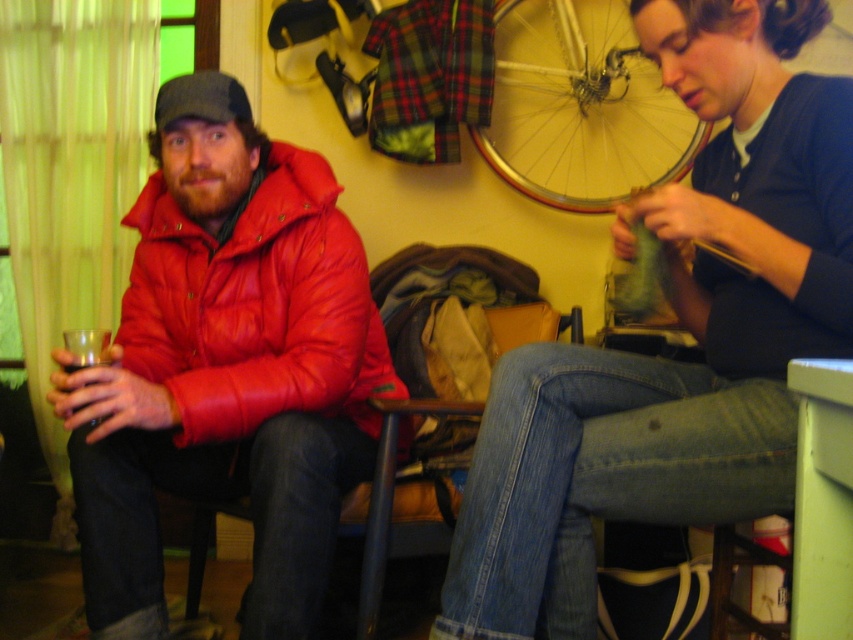
Question: Among these objects, which one is nearest to the camera?

Choices:
 (A) silver metallic bicycle wheel at upper center
 (B) matte red jacket at left
 (C) matte red puffer jacket at left

Answer: (B)

Question: Does matte red jacket at left have a smaller size compared to matte red puffer jacket at left?

Choices:
 (A) yes
 (B) no

Answer: (B)

Question: Does denim jeans at center appear over silver metallic bicycle wheel at upper center?

Choices:
 (A) no
 (B) yes

Answer: (A)

Question: Estimate the real-world distances between objects in this image. Which object is closer to the matte leather chair at center?

Choices:
 (A) black matte cup at left
 (B) silver metallic bicycle wheel at upper center

Answer: (A)

Question: Which object is farther from the camera taking this photo?

Choices:
 (A) matte leather chair at center
 (B) silver metallic bicycle wheel at upper center

Answer: (B)

Question: Does matte red jacket at left lie behind matte red puffer jacket at left?

Choices:
 (A) no
 (B) yes

Answer: (A)